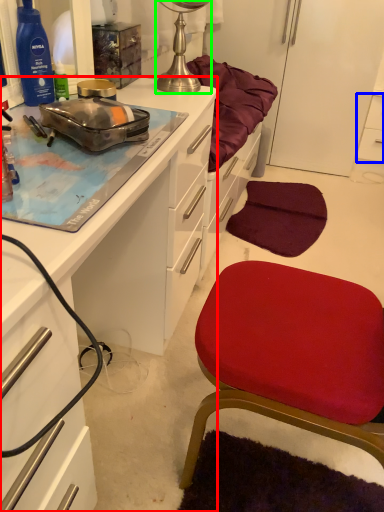
Question: Which is farther away from cabinetry (highlighted by a red box)? cabinetry (highlighted by a blue box) or lamp (highlighted by a green box)?

Choices:
 (A) cabinetry
 (B) lamp

Answer: (A)